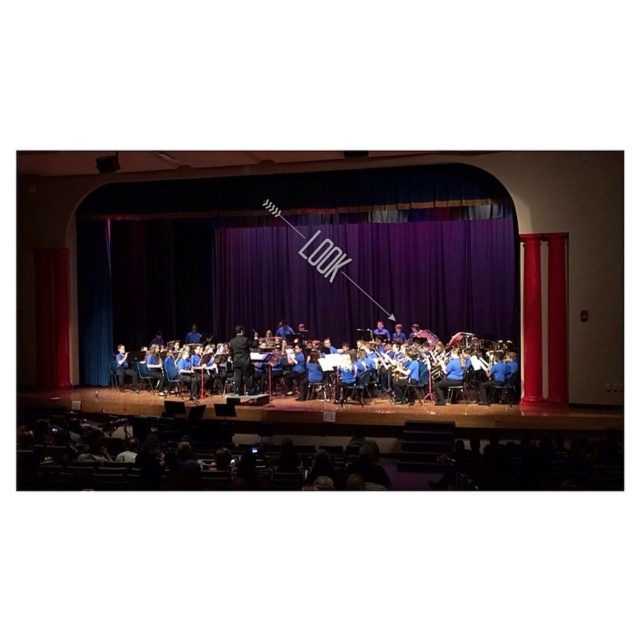
You are a stagehand preparing to adjust the lighting for the performance. You need to position a spotlight so it shines directly on the blue metallic flute at center without illuminating the purple velvet curtain at center. Based on their positions, is this possible?

The purple velvet curtain at center is above the blue metallic flute at center, so positioning the spotlight to shine directly on the blue metallic flute at center while avoiding the curtain is possible by angling the light upward from below.

You are a stagehand preparing to adjust the lighting for the performance. You need to position a spotlight so it shines on the blue metallic flute at center without illuminating the blue fabric curtain at center. Based on their positions, which object should you aim the spotlight towards first?

The blue metallic flute at center is to the right of the blue fabric curtain at center, so you should aim the spotlight towards the blue metallic flute at center first to avoid the curtain.

You are standing in the school auditorium and want to know how far the point at coordinates (294, 289) is from where you are standing. Can you determine the distance?

The point at coordinates (294, 289) is 56.39 feet away from your current position in the school auditorium.